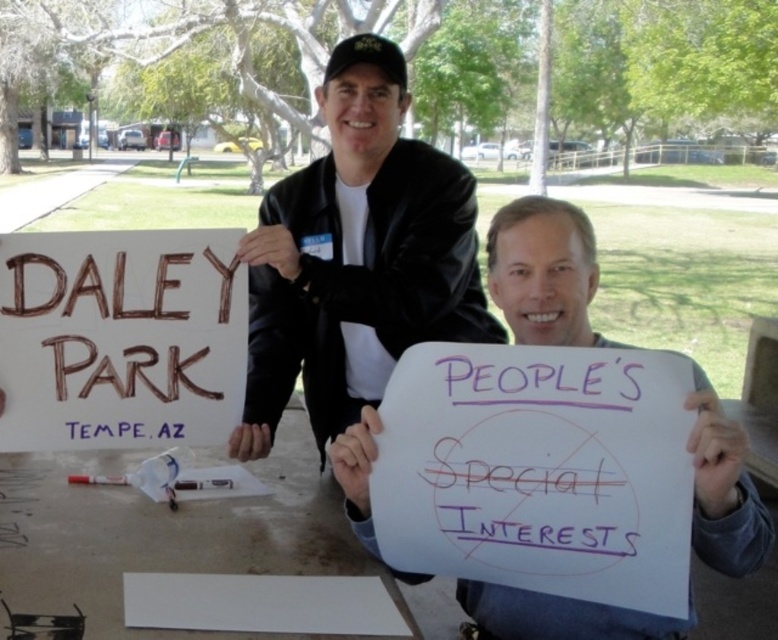
How distant is black leather jacket at center from brown cardboard sign at upper left?

9.77 inches

Which of these two, black leather jacket at center or brown cardboard sign at upper left, stands shorter?

With less height is brown cardboard sign at upper left.

Identify the location of black leather jacket at center. (356, 257).